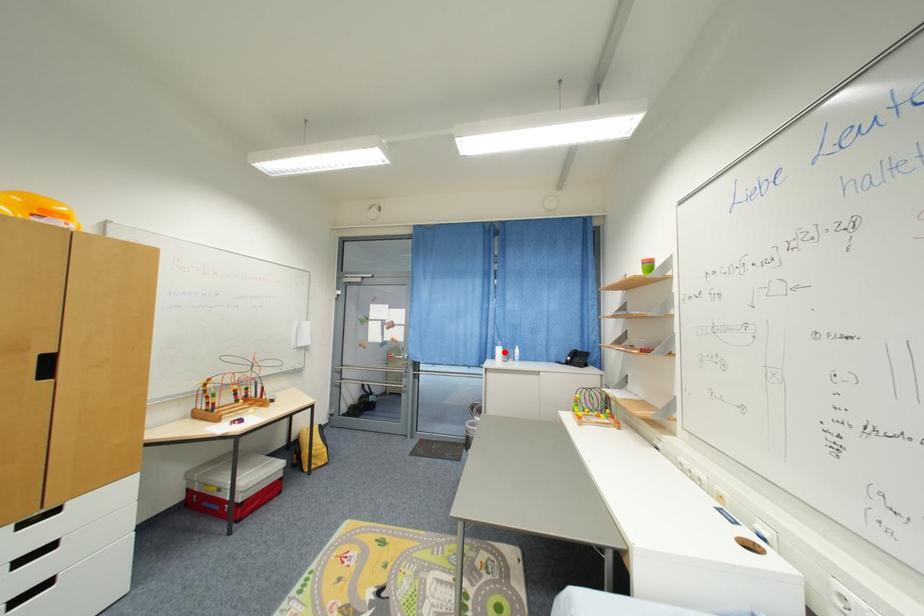
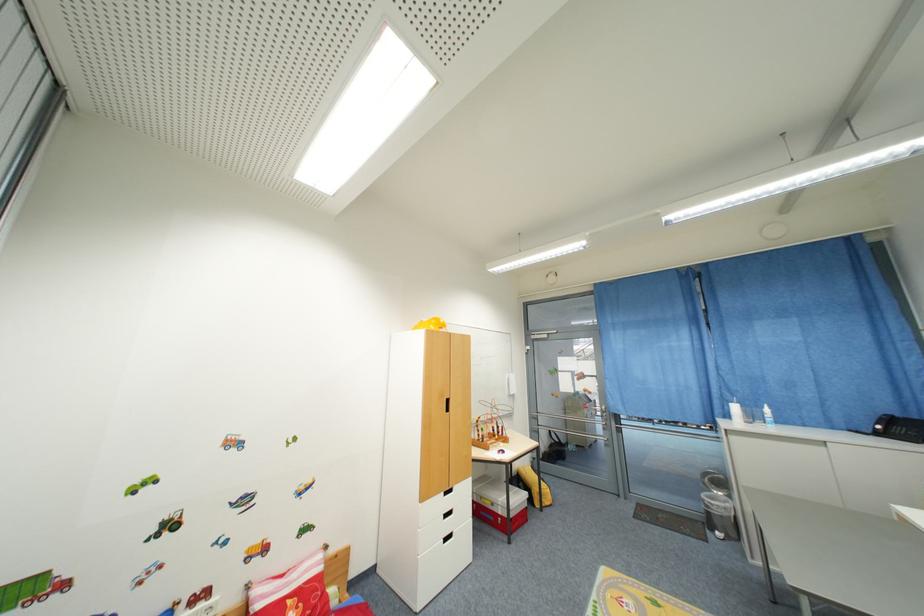
Find the pixel in the second image that matches the highlighted location in the first image.

(740, 410)